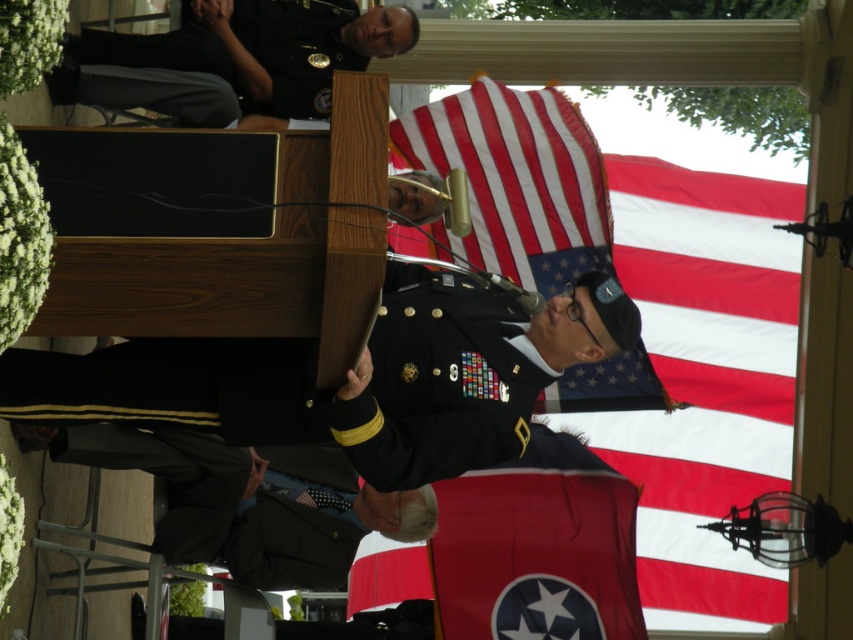
Question: Based on their relative distances, which object is farther from the red/white striped fabric at center?

Choices:
 (A) red fabric flag at center
 (B) shiny black uniform at center

Answer: (B)

Question: Which point is farther to the camera?

Choices:
 (A) red/white striped fabric at center
 (B) shiny black uniform at center
 (C) red fabric flag at center

Answer: (C)

Question: Based on their relative distances, which object is nearer to the red fabric flag at center?

Choices:
 (A) shiny black uniform at center
 (B) dark gray suit at lower left
 (C) black uniform at upper left
 (D) red/white striped fabric at center

Answer: (B)

Question: Considering the relative positions of dark gray suit at lower left and black uniform at upper left in the image provided, where is dark gray suit at lower left located with respect to black uniform at upper left?

Choices:
 (A) below
 (B) above

Answer: (A)

Question: Can you confirm if red/white striped fabric at center is bigger than dark gray suit at lower left?

Choices:
 (A) no
 (B) yes

Answer: (A)

Question: Is shiny black uniform at center behind dark gray suit at lower left?

Choices:
 (A) no
 (B) yes

Answer: (A)